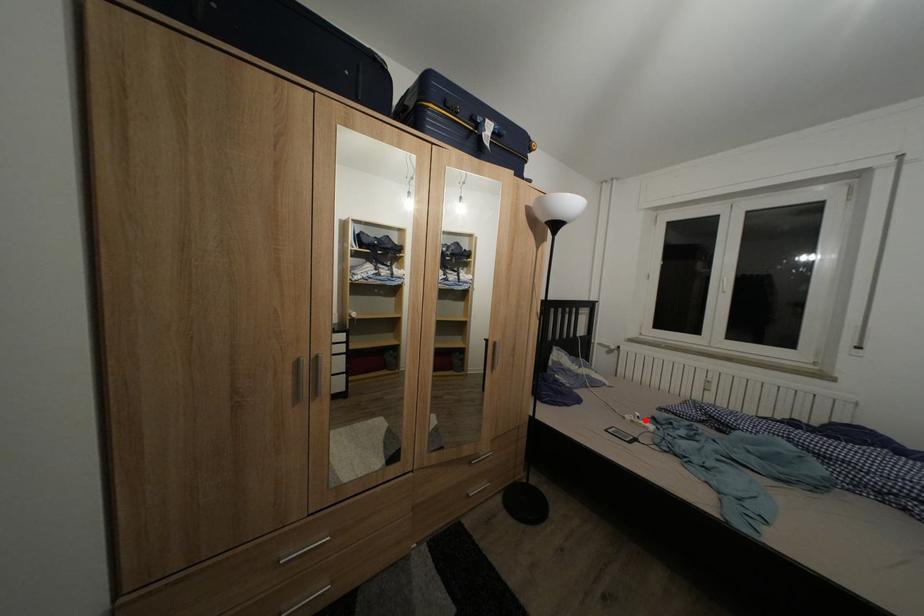
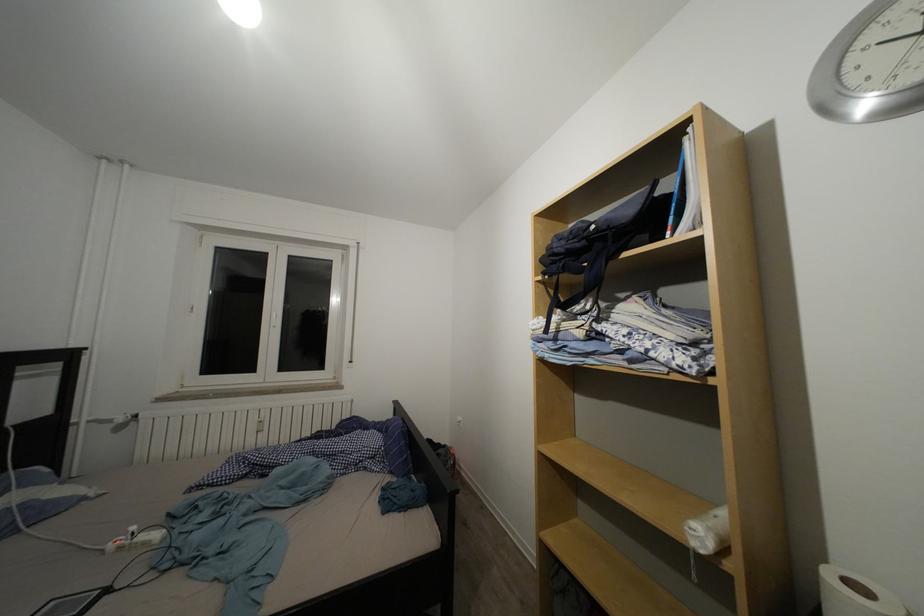
In the second image, find the point that corresponds to the highlighted location in the first image.

(140, 533)